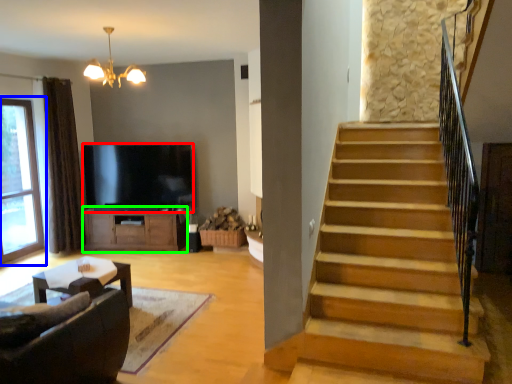
Question: Considering the real-world distances, which object is closest to television (highlighted by a red box)? window (highlighted by a blue box) or cabinetry (highlighted by a green box).

Choices:
 (A) window
 (B) cabinetry

Answer: (B)